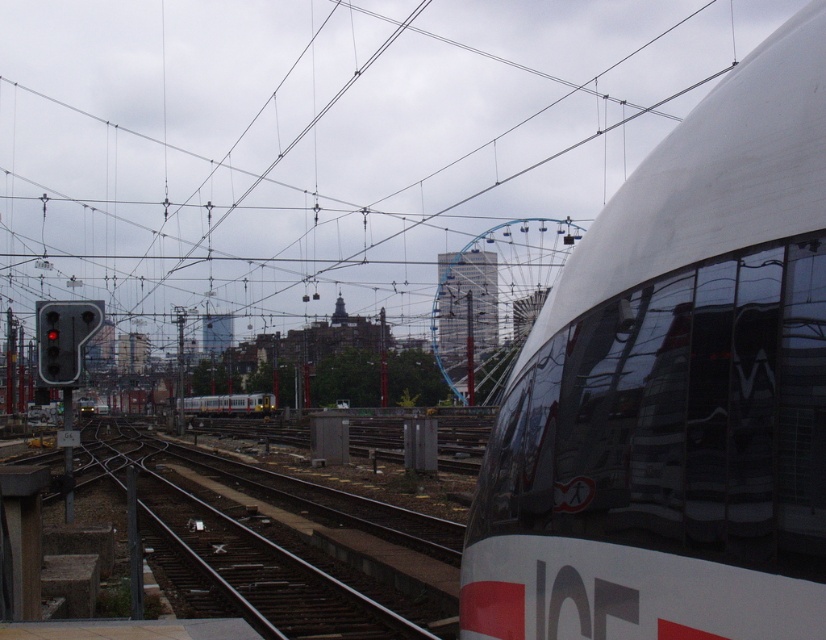
Is black plastic traffic light at left thinner than silver metallic train at center?

Correct, black plastic traffic light at left's width is less than silver metallic train at center's.

Between point (81, 332) and point (200, 412), which one is positioned in front?

Positioned in front is point (81, 332).

The image size is (826, 640). Describe the element at coordinates (64, 337) in the screenshot. I see `black plastic traffic light at left` at that location.

Find the location of a particular element. Image resolution: width=826 pixels, height=640 pixels. black plastic traffic light at left is located at coordinates (64, 337).

Which is above, metallic wire at upper center or white glossy train at center?

metallic wire at upper center is above.

Is point (231, 148) more distant than point (703, 502)?

Yes, point (231, 148) is farther from viewer.

You are a GUI agent. You are given a task and a screenshot of the screen. Output one action in this format:
    pyautogui.click(x=<x>, y=<y>)
    Task: Click on the metallic wire at upper center
    Image resolution: width=826 pixels, height=640 pixels.
    Given the screenshot: What is the action you would take?
    pyautogui.click(x=317, y=145)

Is white glossy train at center positioned behind black plastic traffic light at left?

No, it is not.

Does white glossy train at center have a smaller size compared to black plastic traffic light at left?

Actually, white glossy train at center might be larger than black plastic traffic light at left.

In the scene shown: Who is more forward, (483, 531) or (44, 376)?

Point (483, 531) is in front.

Where is `white glossy train at center`? white glossy train at center is located at coordinates (676, 388).